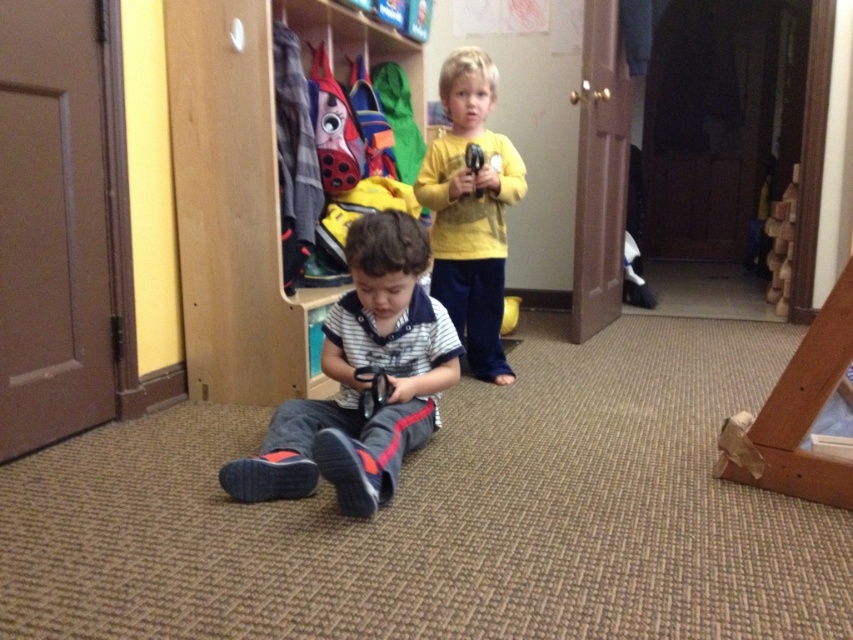
Question: Can you confirm if wooden at center is positioned above yellow matte shirt at upper center?

Choices:
 (A) yes
 (B) no

Answer: (A)

Question: Estimate the real-world distances between objects in this image. Which object is closer to the wooden at center?

Choices:
 (A) yellow matte shirt at upper center
 (B) striped cotton shirt at center

Answer: (B)

Question: In this image, where is wooden at center located relative to yellow matte shirt at upper center?

Choices:
 (A) right
 (B) left

Answer: (B)

Question: Based on their relative distances, which object is nearer to the striped cotton shirt at center?

Choices:
 (A) yellow matte shirt at upper center
 (B) wooden at center

Answer: (B)

Question: Estimate the real-world distances between objects in this image. Which object is closer to the striped cotton shirt at center?

Choices:
 (A) wooden at center
 (B) yellow matte shirt at upper center

Answer: (A)

Question: Is wooden at center wider than striped cotton shirt at center?

Choices:
 (A) yes
 (B) no

Answer: (B)